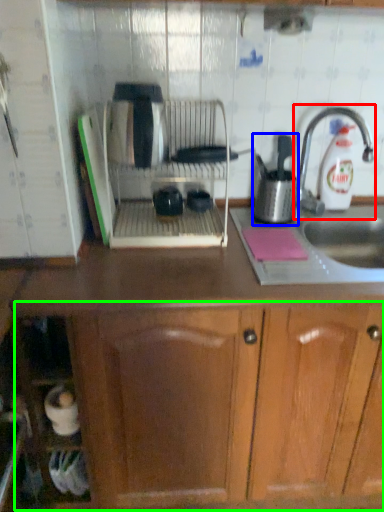
Question: Which object is the farthest from tap (highlighted by a red box)? Choose among these: kitchen appliance (highlighted by a blue box) or drawer (highlighted by a green box).

Choices:
 (A) kitchen appliance
 (B) drawer

Answer: (B)